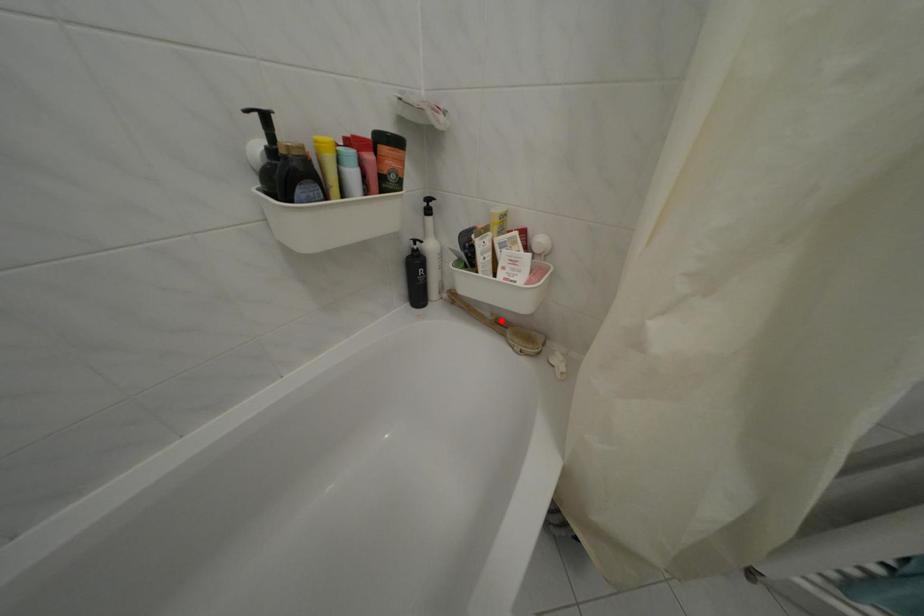
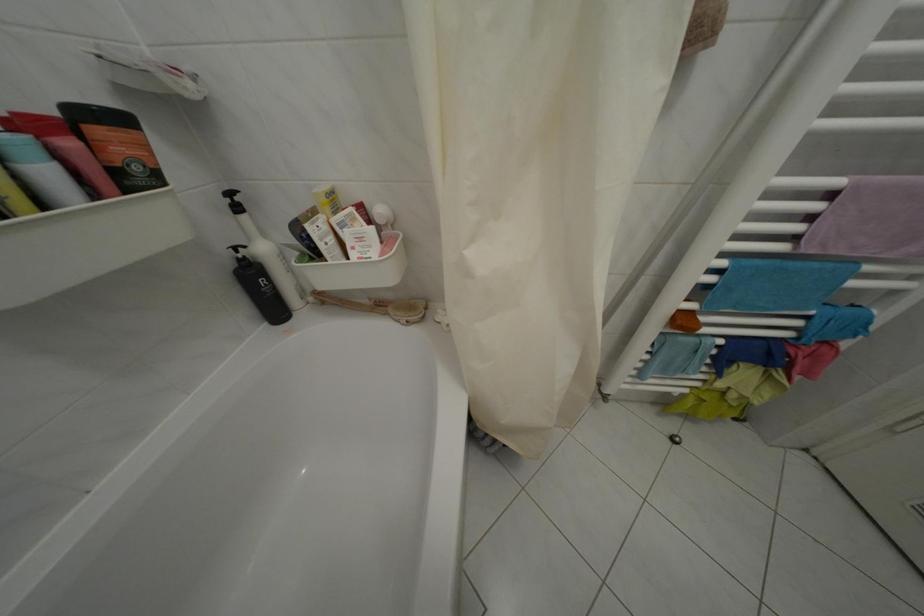
The point at the highlighted location is marked in the first image. Where is the corresponding point in the second image?

(379, 306)